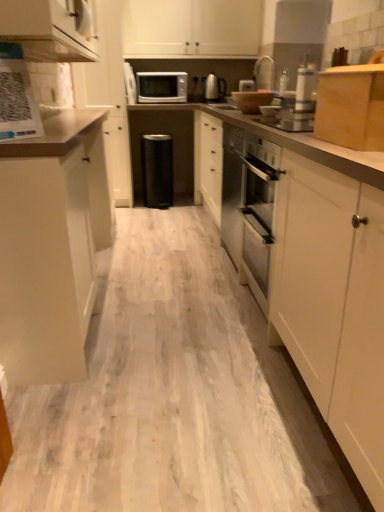
Where is `free spot above white laminate countertop at center (from a real-world perspective)`? The width and height of the screenshot is (384, 512). free spot above white laminate countertop at center (from a real-world perspective) is located at coordinates (165, 293).